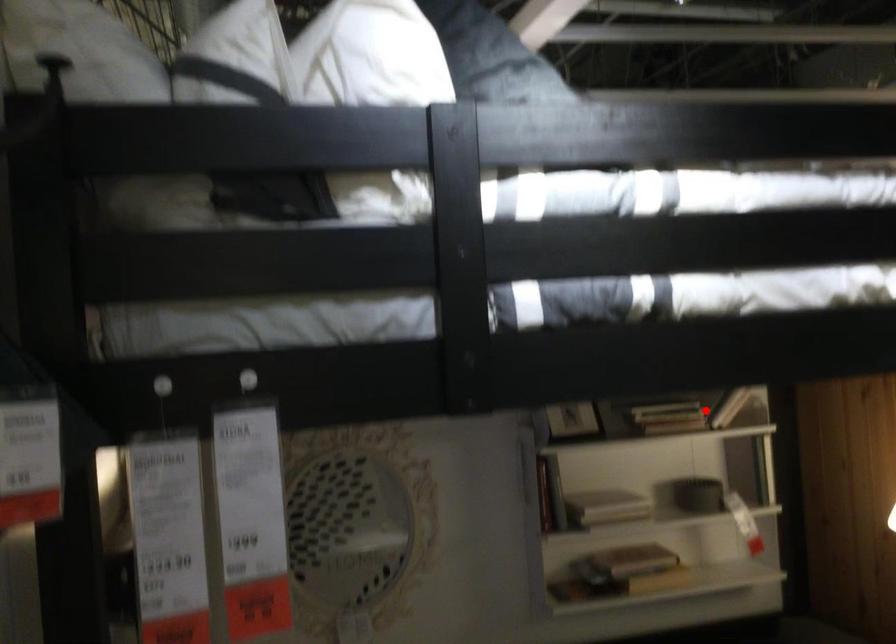
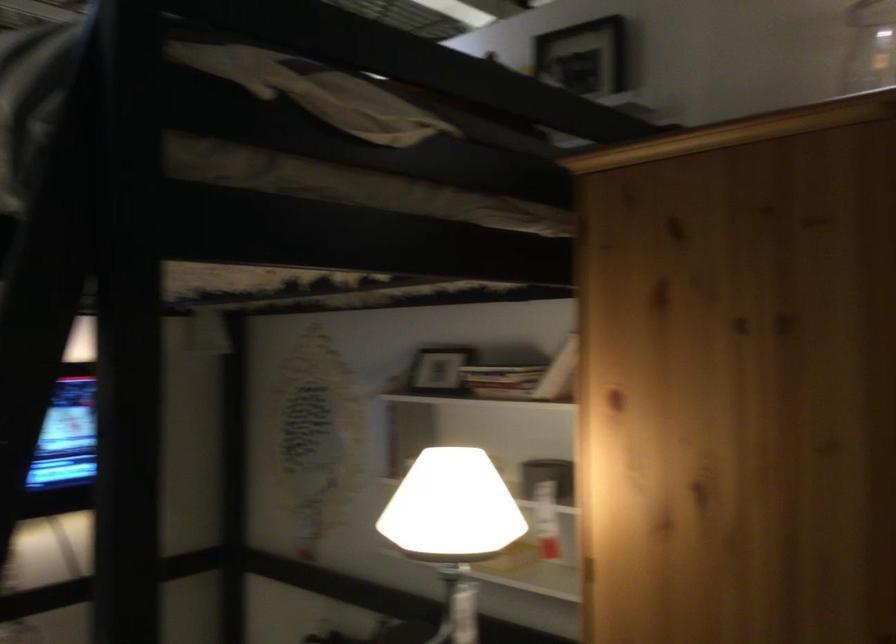
Find the pixel in the second image that matches the highlighted location in the first image.

(501, 379)